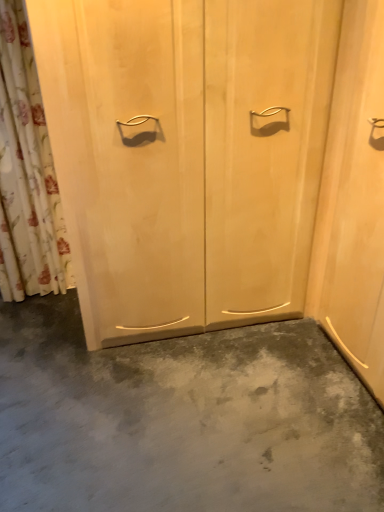
Question: Is floral fabric shower curtain at left facing away from gray matte concrete at center?

Choices:
 (A) yes
 (B) no

Answer: (B)

Question: From the image's perspective, would you say floral fabric shower curtain at left is positioned over gray matte concrete at center?

Choices:
 (A) no
 (B) yes

Answer: (B)

Question: Is floral fabric shower curtain at left taller than gray matte concrete at center?

Choices:
 (A) no
 (B) yes

Answer: (B)

Question: Does floral fabric shower curtain at left appear on the right side of gray matte concrete at center?

Choices:
 (A) yes
 (B) no

Answer: (B)

Question: From a real-world perspective, does floral fabric shower curtain at left stand above gray matte concrete at center?

Choices:
 (A) no
 (B) yes

Answer: (B)

Question: Is gray matte concrete at center bigger or smaller than light wood/texture door at center?

Choices:
 (A) big
 (B) small

Answer: (B)

Question: From the image's perspective, is gray matte concrete at center located above or below light wood/texture door at center?

Choices:
 (A) below
 (B) above

Answer: (A)

Question: Does point (187, 468) appear closer or farther from the camera than point (213, 151)?

Choices:
 (A) closer
 (B) farther

Answer: (A)

Question: Based on their positions, is gray matte concrete at center located to the left or right of light wood/texture door at center?

Choices:
 (A) right
 (B) left

Answer: (B)

Question: Looking at the image, does gray matte concrete at center seem bigger or smaller compared to floral fabric shower curtain at left?

Choices:
 (A) small
 (B) big

Answer: (B)

Question: From the image's perspective, relative to floral fabric shower curtain at left, is gray matte concrete at center above or below?

Choices:
 (A) above
 (B) below

Answer: (B)

Question: From a real-world perspective, is gray matte concrete at center positioned above or below floral fabric shower curtain at left?

Choices:
 (A) above
 (B) below

Answer: (B)

Question: In terms of width, does gray matte concrete at center look wider or thinner when compared to floral fabric shower curtain at left?

Choices:
 (A) wide
 (B) thin

Answer: (A)

Question: Considering the positions of point (16, 159) and point (226, 292), is point (16, 159) closer or farther from the camera than point (226, 292)?

Choices:
 (A) farther
 (B) closer

Answer: (A)

Question: Based on their positions, is floral fabric shower curtain at left located to the left or right of light wood/texture door at center?

Choices:
 (A) right
 (B) left

Answer: (B)